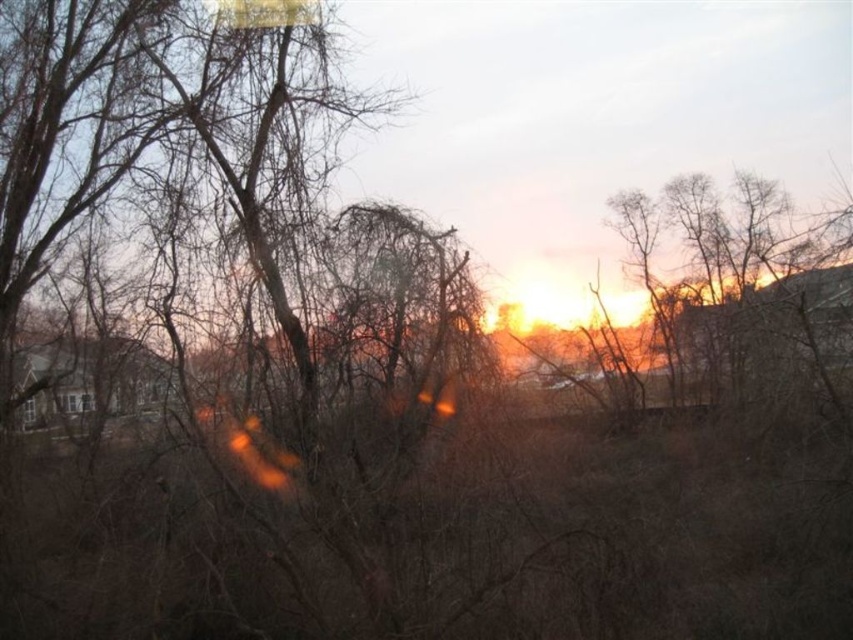
Question: Is clear glass window at lower left to the left of transparent glass window at lower left from the viewer's perspective?

Choices:
 (A) no
 (B) yes

Answer: (A)

Question: Does clear glass window at lower left come behind transparent glass window at lower left?

Choices:
 (A) no
 (B) yes

Answer: (A)

Question: Which of the following is the farthest from the observer?

Choices:
 (A) clear glass window at lower left
 (B) transparent glass window at lower left

Answer: (B)

Question: Can you confirm if clear glass window at lower left is bigger than transparent glass window at lower left?

Choices:
 (A) no
 (B) yes

Answer: (B)

Question: Among these objects, which one is nearest to the camera?

Choices:
 (A) clear glass window at lower left
 (B) transparent glass window at lower left

Answer: (A)